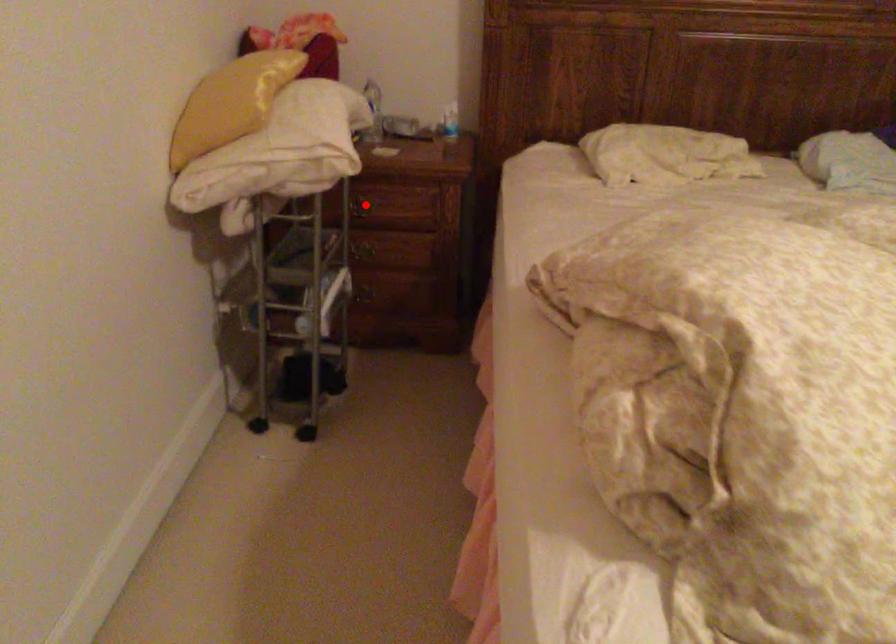
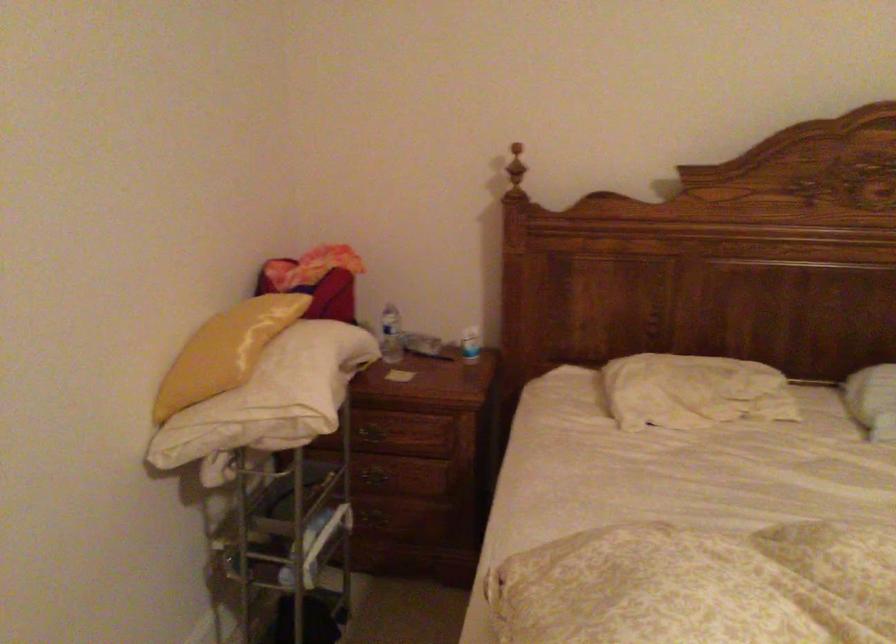
In the second image, find the point that corresponds to the highlighted location in the first image.

(374, 430)